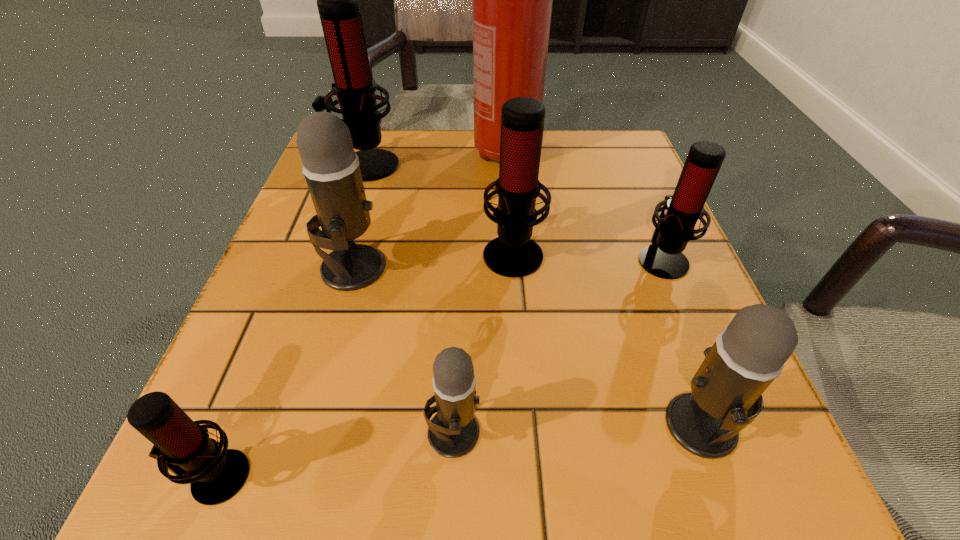
In the image, there is a desktop. Where is `vacant space at the near left corner`? The width and height of the screenshot is (960, 540). vacant space at the near left corner is located at coordinates (165, 513).

The height and width of the screenshot is (540, 960). In the image, there is a desktop. What are the coordinates of `free space at the far right corner` in the screenshot? It's located at (639, 157).

The width and height of the screenshot is (960, 540). Identify the location of vacant point located between the fifth microphone from left to right and the second gray microphone from right to left. (483, 342).

Where is `free spot between the second smallest gray microphone and the smallest gray microphone`? This screenshot has width=960, height=540. free spot between the second smallest gray microphone and the smallest gray microphone is located at coordinates (577, 429).

Identify the location of free spot between the fire extinguisher and the second smallest gray microphone. (604, 289).

The image size is (960, 540). I want to click on empty space that is in between the third smallest red microphone and the biggest gray microphone, so click(433, 260).

You are a GUI agent. You are given a task and a screenshot of the screen. Output one action in this format:
    pyautogui.click(x=<x>, y=<y>)
    Task: Click on the vacant area between the second smallest gray microphone and the biggest gray microphone
    Image resolution: width=960 pixels, height=540 pixels.
    Given the screenshot: What is the action you would take?
    pyautogui.click(x=527, y=347)

This screenshot has height=540, width=960. Identify the location of free point between the second biggest red microphone and the second biggest gray microphone. (607, 339).

This screenshot has width=960, height=540. I want to click on vacant region between the smallest red microphone and the biggest gray microphone, so click(284, 372).

This screenshot has width=960, height=540. What are the coordinates of `the fifth closest object to the fifth microphone from left to right` in the screenshot? It's located at (337, 0).